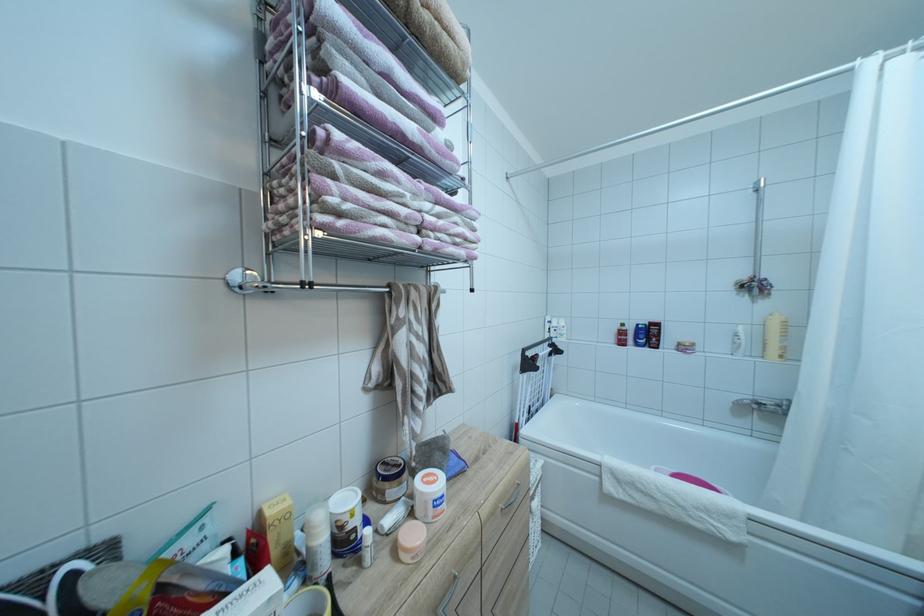
Where would you push the white bottle pump? Please return your answer as a coordinate pair (x, y).

(774, 337)